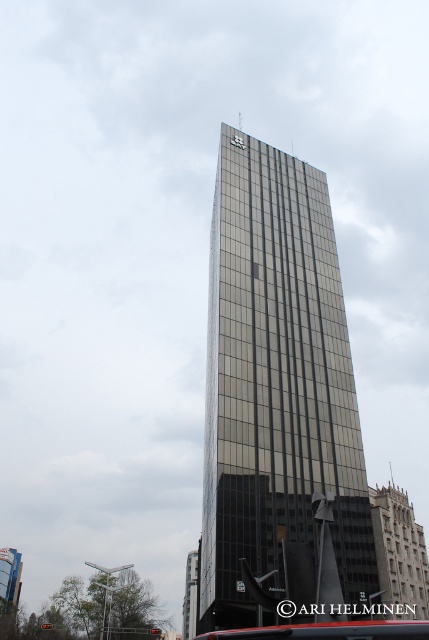
How far apart are reflective glass tower at center and metallic bus at center?

The distance of reflective glass tower at center from metallic bus at center is 25.28 meters.

Where is `reflective glass tower at center`? The width and height of the screenshot is (429, 640). reflective glass tower at center is located at coordinates (275, 385).

Is point (277, 212) closer to camera compared to point (337, 632)?

That is False.

Find the location of a particular element. This screenshot has width=429, height=640. reflective glass tower at center is located at coordinates (275, 385).